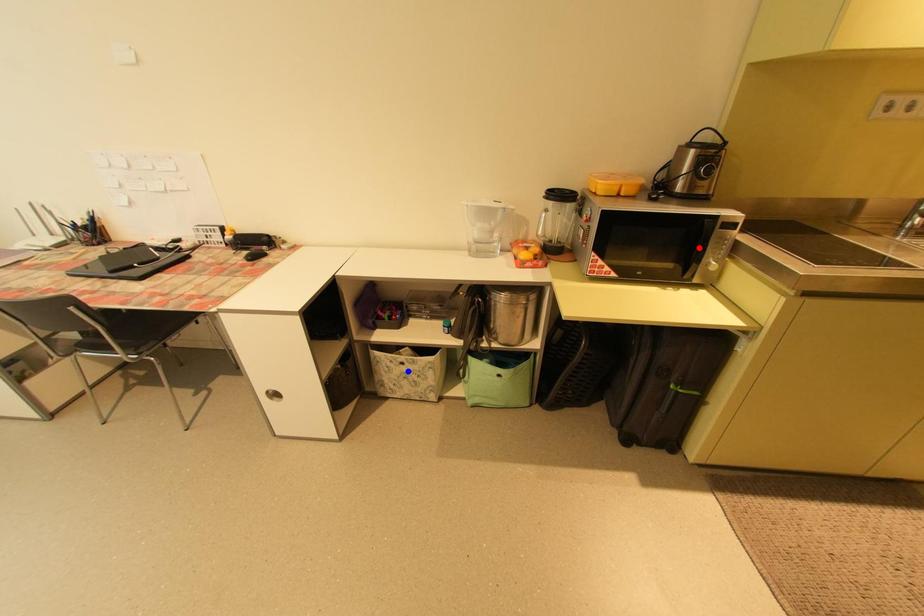
Question: Which of the two points in the image is closer to the camera?

Choices:
 (A) Blue point is closer.
 (B) Red point is closer.

Answer: (B)